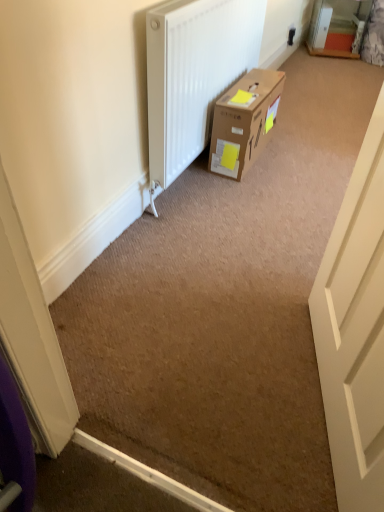
Question: Considering the relative positions of white matte door at right and white plastic electric outlet at upper right in the image provided, is white matte door at right to the left or to the right of white plastic electric outlet at upper right?

Choices:
 (A) right
 (B) left

Answer: (B)

Question: Is white matte door at right bigger or smaller than white plastic electric outlet at upper right?

Choices:
 (A) small
 (B) big

Answer: (B)

Question: Which object is positioned farthest from the white plastic electric outlet at upper right?

Choices:
 (A) white matte door at right
 (B) brown cardboard box at center

Answer: (A)

Question: Which object is the farthest from the white plastic electric outlet at upper right?

Choices:
 (A) white matte door at right
 (B) brown cardboard box at center

Answer: (A)